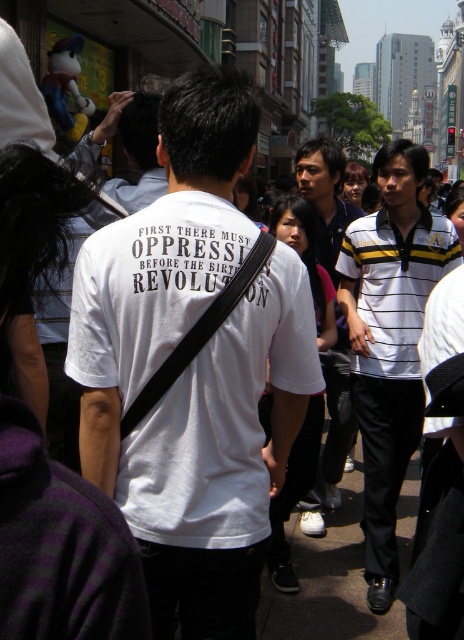
Does white matte t-shirt at center appear on the right side of striped polo shirt at center?

No, white matte t-shirt at center is not to the right of striped polo shirt at center.

Identify the location of white matte t-shirt at center. [x=193, y=365].

Does white matte t-shirt at center appear over white striped polo shirt at center?

No, white matte t-shirt at center is not above white striped polo shirt at center.

Is white matte t-shirt at center shorter than white striped polo shirt at center?

Yes.

This screenshot has height=640, width=464. What do you see at coordinates (193, 365) in the screenshot?
I see `white matte t-shirt at center` at bounding box center [193, 365].

In order to click on white matte t-shirt at center in this screenshot , I will do `click(193, 365)`.

Can you confirm if white striped polo shirt at center is taller than striped polo shirt at center?

Correct, white striped polo shirt at center is much taller as striped polo shirt at center.

Which is more to the left, white striped polo shirt at center or striped polo shirt at center?

Positioned to the left is striped polo shirt at center.

This screenshot has width=464, height=640. Identify the location of white striped polo shirt at center. (390, 340).